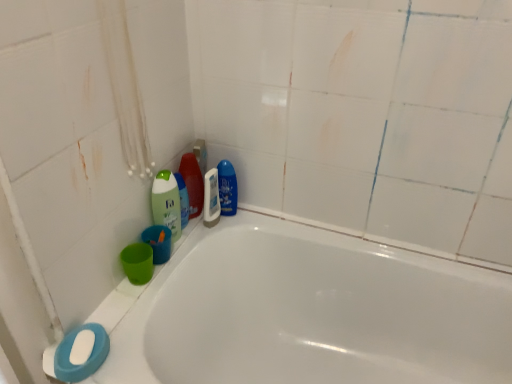
Identify the location of unoccupied area in front of blue glossy bottle at upper center, the 1th cleaning product from the right. The width and height of the screenshot is (512, 384). (214, 236).